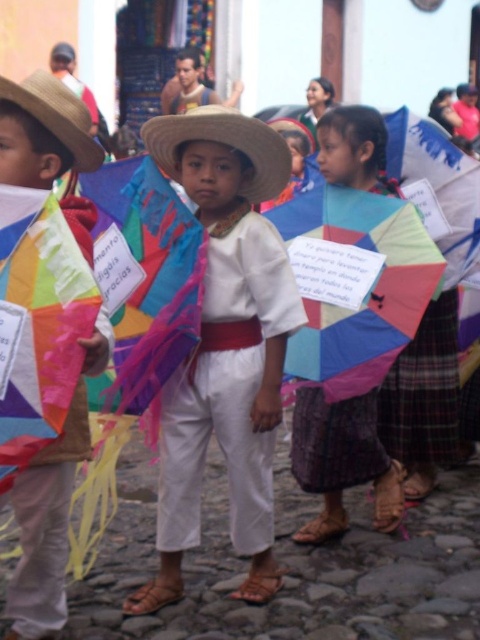
Is multicolored paper kite at center to the left of natural straw hat at left from the viewer's perspective?

In fact, multicolored paper kite at center is to the right of natural straw hat at left.

Measure the distance from multicolored paper kite at center to natural straw hat at left.

multicolored paper kite at center and natural straw hat at left are 9.13 feet apart from each other.

What do you see at coordinates (343, 460) in the screenshot? This screenshot has width=480, height=640. I see `multicolored paper kite at center` at bounding box center [343, 460].

Image resolution: width=480 pixels, height=640 pixels. In order to click on multicolored paper kite at center in this screenshot , I will do `click(343, 460)`.

The image size is (480, 640). Describe the element at coordinates (225, 344) in the screenshot. I see `white cotton shirt at center` at that location.

Is white cotton shirt at center in front of multicolored paper kite at center?

Yes, it is in front of multicolored paper kite at center.

Is point (207, 406) positioned before point (323, 515)?

Yes, point (207, 406) is closer to viewer.

At what (x,y) coordinates should I click in order to perform the action: click on white cotton shirt at center. Please return your answer as a coordinate pair (x, y). The image size is (480, 640). Looking at the image, I should click on (225, 344).

In the scene shown: Can you confirm if multicolored paper kite at center is positioned to the left of straw hat at center?

Incorrect, multicolored paper kite at center is not on the left side of straw hat at center.

Which is above, multicolored paper kite at center or straw hat at center?

Positioned higher is straw hat at center.

You are a GUI agent. You are given a task and a screenshot of the screen. Output one action in this format:
    pyautogui.click(x=<x>, y=<y>)
    Task: Click on the multicolored paper kite at center
    The width and height of the screenshot is (480, 640).
    Given the screenshot: What is the action you would take?
    pyautogui.click(x=343, y=460)